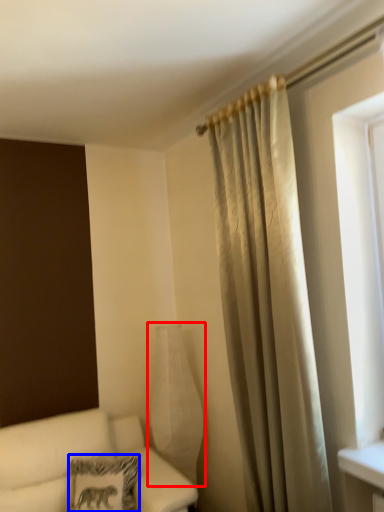
Question: Which object is further to the camera taking this photo, glass vase (highlighted by a red box) or pillow (highlighted by a blue box)?

Choices:
 (A) glass vase
 (B) pillow

Answer: (A)